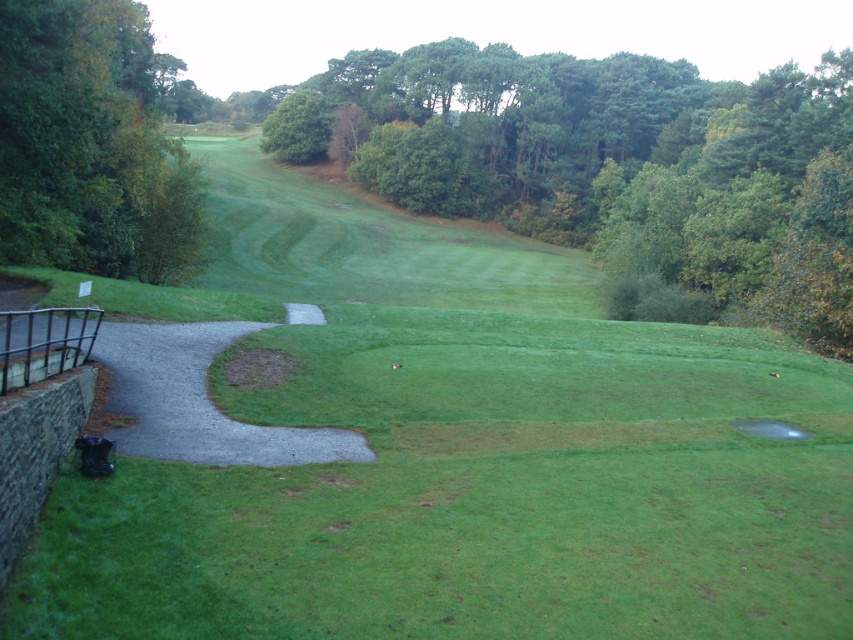
Between point (115, 356) and point (790, 436), which one is positioned in front?

Point (790, 436) is in front.

Is gray gravel path at left positioned at the back of transparent plastic hole at center?

No, gray gravel path at left is closer to the viewer.

Between point (215, 340) and point (743, 428), which one is positioned in front?

Point (743, 428)

Where is `gray gravel path at left`? gray gravel path at left is located at coordinates (199, 401).

Which is below, green leafy trees at center or green leafy tree at left?

Positioned lower is green leafy tree at left.

Is point (421, 147) in front of point (45, 61)?

No, (421, 147) is behind (45, 61).

Locate an element on the screen. The image size is (853, 640). green leafy trees at center is located at coordinates (614, 164).

Does green leafy trees at center have a smaller size compared to gray gravel path at left?

Actually, green leafy trees at center might be larger than gray gravel path at left.

Who is positioned more to the left, green leafy trees at center or gray gravel path at left?

gray gravel path at left

Where is `green leafy trees at center`? green leafy trees at center is located at coordinates (614, 164).

Identify the location of green leafy trees at center. This screenshot has height=640, width=853. (614, 164).